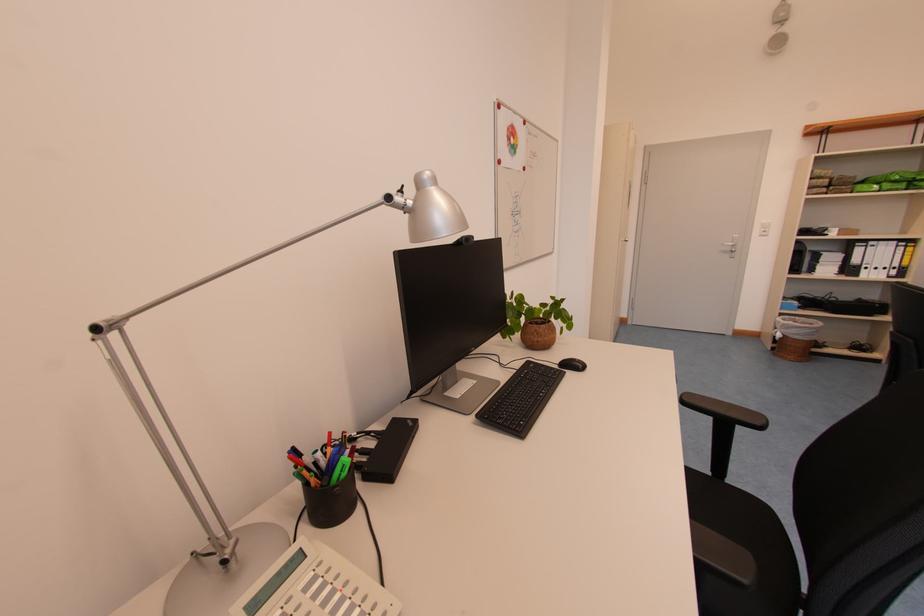
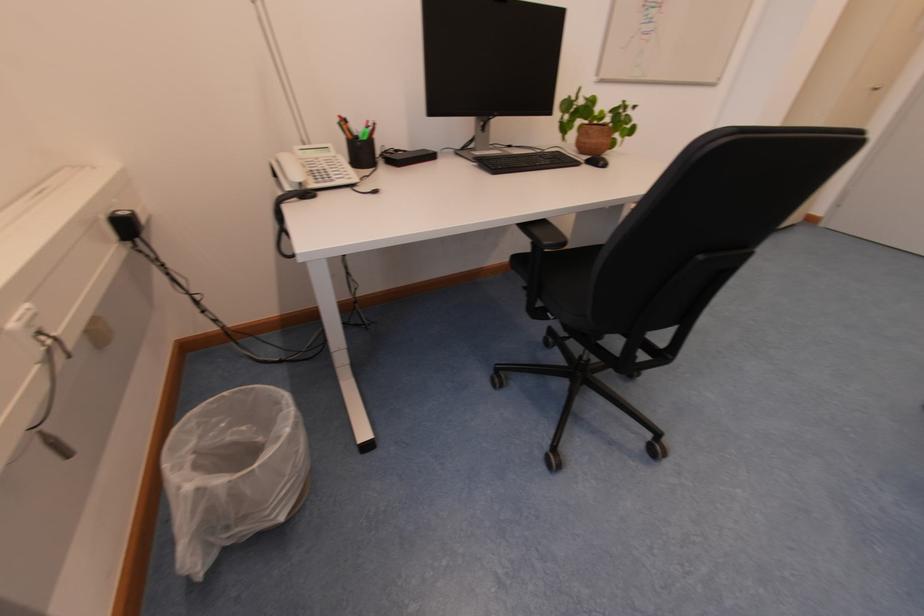
Based on the continuous images, in which direction is the camera rotating?

The camera rotated toward left-down.